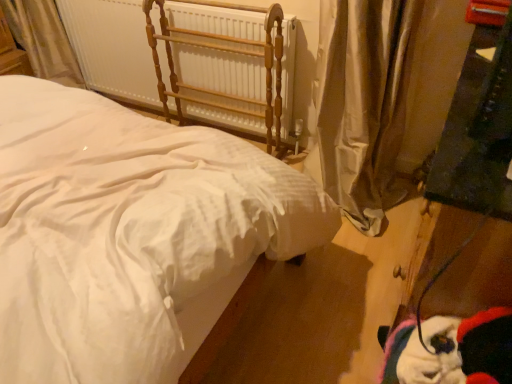
Question: From the image's perspective, is white cotton bed at center located above or below silky beige curtain at right?

Choices:
 (A) below
 (B) above

Answer: (A)

Question: In the image, is white cotton bed at center positioned in front of or behind silky beige curtain at right?

Choices:
 (A) front
 (B) behind

Answer: (A)

Question: Estimate the real-world distances between objects in this image. Which object is farther from the white painted metal radiator at upper center?

Choices:
 (A) silky beige curtain at right
 (B) white cotton bed at center

Answer: (B)

Question: Which of these objects is positioned farthest from the silky beige curtain at right?

Choices:
 (A) white painted metal radiator at upper center
 (B) white cotton bed at center

Answer: (B)